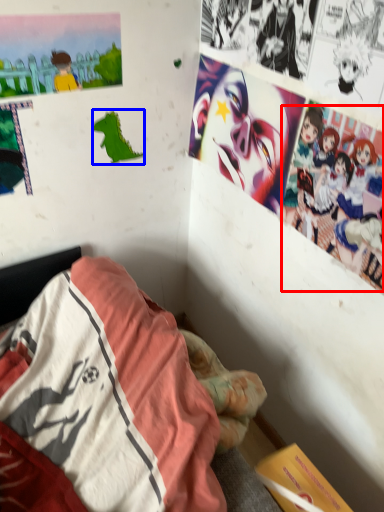
Question: Which object is further to the camera taking this photo, person (highlighted by a red box) or art (highlighted by a blue box)?

Choices:
 (A) person
 (B) art

Answer: (B)